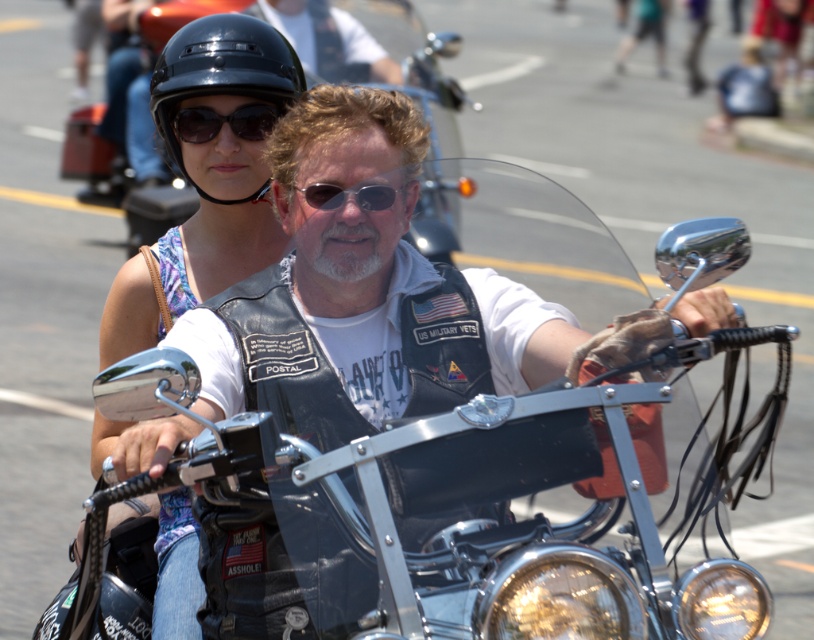
Question: Which point is farther to the camera?

Choices:
 (A) click(x=177, y=115)
 (B) click(x=340, y=20)
 (C) click(x=260, y=97)
 (D) click(x=213, y=387)

Answer: (B)

Question: Can you confirm if matte black helmet at upper left is wider than black plastic sunglasses at center?

Choices:
 (A) no
 (B) yes

Answer: (B)

Question: In this image, where is matte black sunglasses at upper center located relative to black plastic sunglasses at center?

Choices:
 (A) right
 (B) left

Answer: (B)

Question: Among these points, which one is farthest from the camera?

Choices:
 (A) (418, 86)
 (B) (311, 36)
 (C) (212, 132)
 (D) (165, 234)

Answer: (B)

Question: Which object is the closest to the matte black helmet at upper left?

Choices:
 (A) leather vest at center
 (B) black plastic sunglasses at center

Answer: (A)

Question: In this image, where is matte black helmet at upper left located relative to black matte helmet at upper center?

Choices:
 (A) above
 (B) below

Answer: (B)